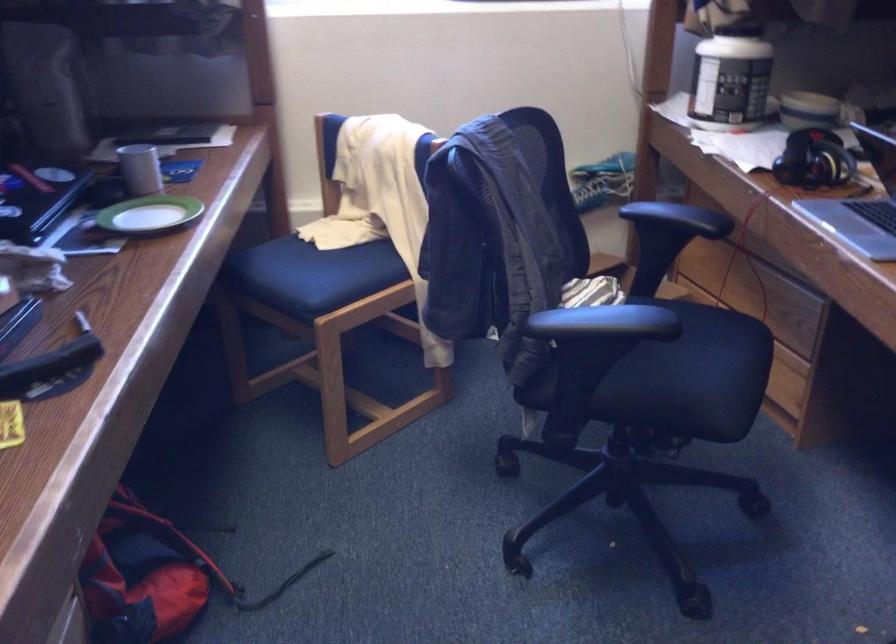
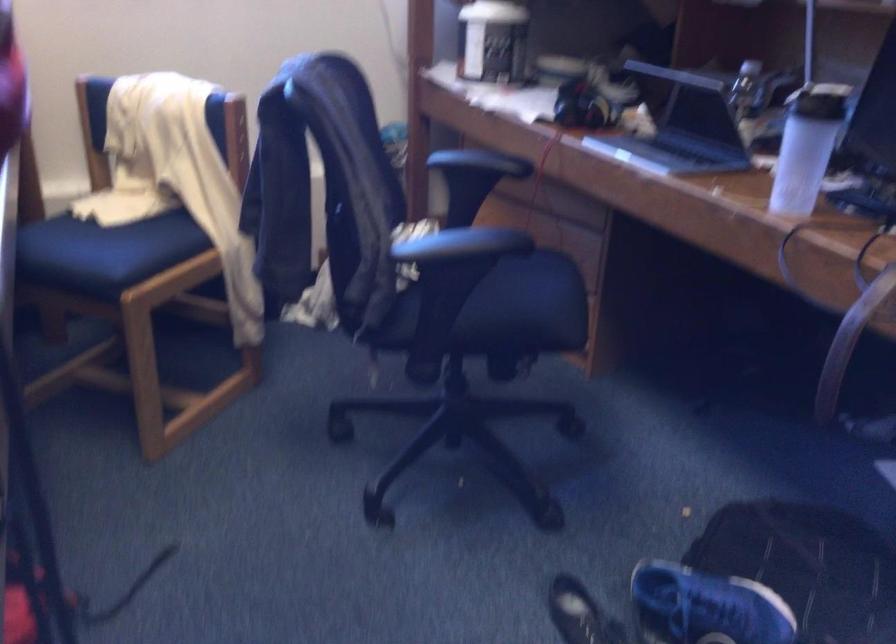
In the second image, find the point that corresponds to [338,225] in the first image.

(123, 200)